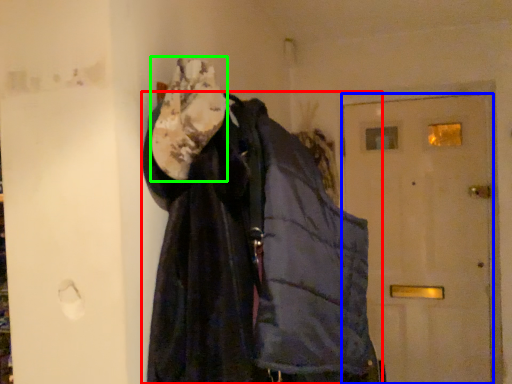
Question: Considering the real-world distances, which object is farthest from jacket (highlighted by a red box)? door (highlighted by a blue box) or scarf (highlighted by a green box)?

Choices:
 (A) door
 (B) scarf

Answer: (A)